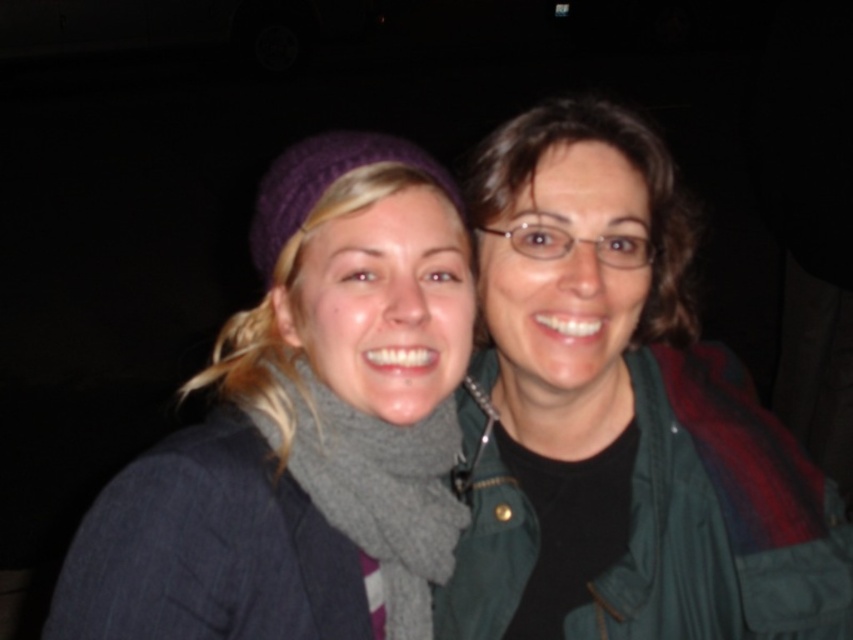
Who is shorter, gray woolen scarf at center or green matte jacket at upper right?

green matte jacket at upper right

Can you confirm if gray woolen scarf at center is positioned below green matte jacket at upper right?

Correct, gray woolen scarf at center is located below green matte jacket at upper right.

Locate an element on the screen. The width and height of the screenshot is (853, 640). gray woolen scarf at center is located at coordinates (381, 493).

Looking at this image, does green matte jacket at center have a smaller size compared to green matte jacket at upper right?

Correct, green matte jacket at center occupies less space than green matte jacket at upper right.

Which is more to the left, green matte jacket at center or green matte jacket at upper right?

green matte jacket at center

Which is behind, point (706, 518) or point (477, 227)?

The point (706, 518) is more distant.

Where is `green matte jacket at center`? The height and width of the screenshot is (640, 853). green matte jacket at center is located at coordinates (619, 417).

Can you confirm if gray woolen scarf at center is shorter than purple knitted hat at upper left?

In fact, gray woolen scarf at center may be taller than purple knitted hat at upper left.

Can you confirm if gray woolen scarf at center is positioned to the left of purple knitted hat at upper left?

No, gray woolen scarf at center is not to the left of purple knitted hat at upper left.

Is point (329, 461) positioned in front of point (291, 202)?

No, it is behind (291, 202).

At what (x,y) coordinates should I click in order to perform the action: click on gray woolen scarf at center. Please return your answer as a coordinate pair (x, y). This screenshot has width=853, height=640. Looking at the image, I should click on [x=381, y=493].